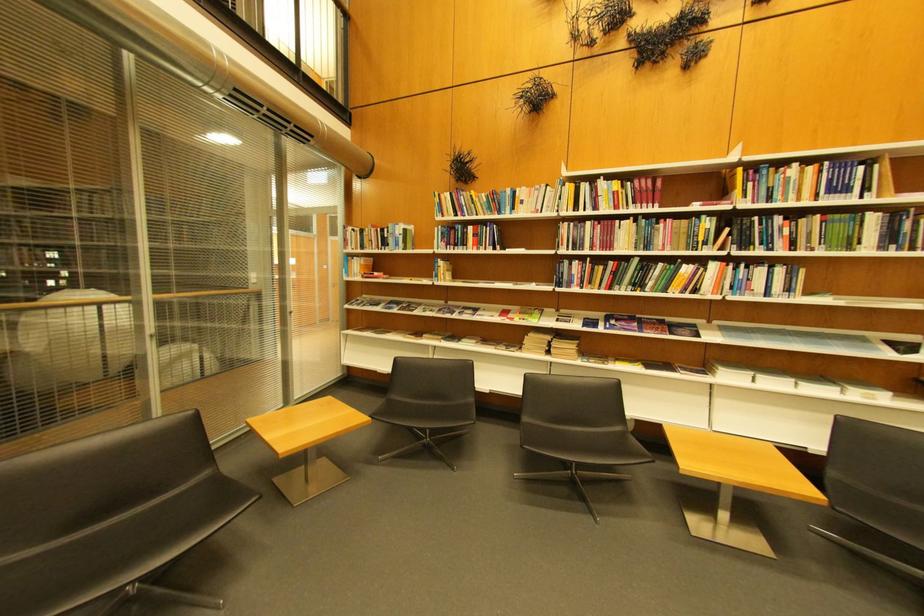
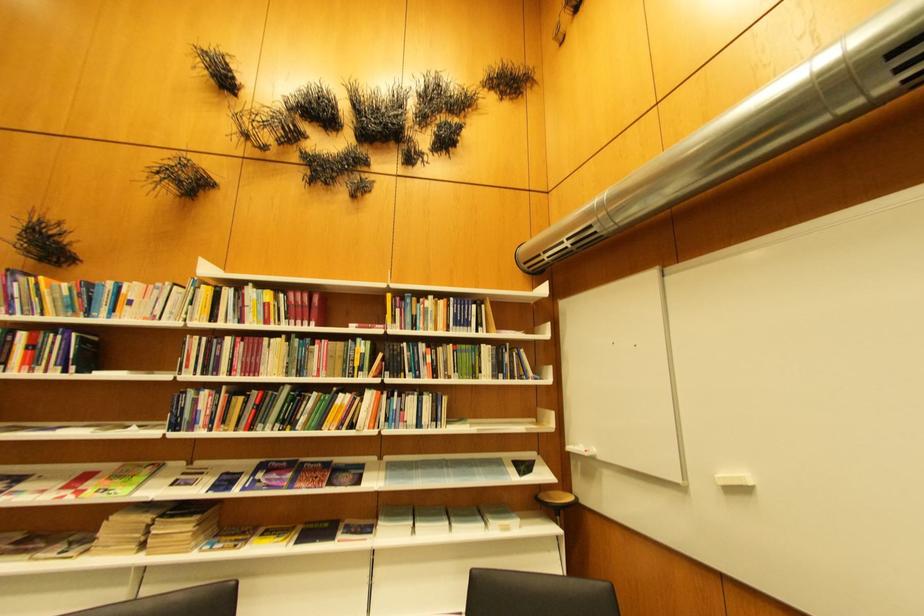
Where in the second image is the point corresponding to the point at 768,381 from the first image?

(427, 530)